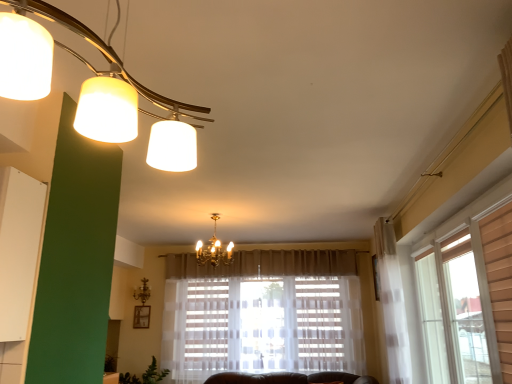
Question: Can we say white matte lampshade at upper left, positioned as the 1th lamp in top-to-bottom order, lies outside gold metallic chandelier at center, the third lamp from the top?

Choices:
 (A) yes
 (B) no

Answer: (A)

Question: From a real-world perspective, is white matte lampshade at upper left, which ranks as the third lamp in bottom-to-top order, physically below gold metallic chandelier at center, the 1th lamp when ordered from back to front?

Choices:
 (A) no
 (B) yes

Answer: (A)

Question: Does white matte lampshade at upper left, which is the 1th lamp in front-to-back order, have a larger size compared to gold metallic chandelier at center, which is counted as the 3th lamp, starting from the right?

Choices:
 (A) no
 (B) yes

Answer: (B)

Question: Would you say white matte lampshade at upper left, positioned as the 1th lamp in top-to-bottom order, contains gold metallic chandelier at center, arranged as the first lamp when viewed from the left?

Choices:
 (A) no
 (B) yes

Answer: (A)

Question: Can you confirm if white matte lampshade at upper left, the third lamp positioned from the back, is thinner than gold metallic chandelier at center, arranged as the first lamp when viewed from the left?

Choices:
 (A) no
 (B) yes

Answer: (A)

Question: From a real-world perspective, does white matte lampshade at upper left, placed as the third lamp when sorted from left to right, stand above gold metallic chandelier at center, which is the first lamp in bottom-to-top order?

Choices:
 (A) yes
 (B) no

Answer: (A)

Question: Is gold metallic chandelier at center, the 2th lamp positioned from the front, facing towards gold metallic chandelier at center, arranged as the first lamp when viewed from the left?

Choices:
 (A) yes
 (B) no

Answer: (B)

Question: Is the position of gold metallic chandelier at center, the 2th lamp positioned from the front, more distant than that of gold metallic chandelier at center, the third lamp from the top?

Choices:
 (A) yes
 (B) no

Answer: (B)

Question: Can you confirm if gold metallic chandelier at center, acting as the 2th lamp starting from the top, is bigger than gold metallic chandelier at center, the 1th lamp when ordered from back to front?

Choices:
 (A) no
 (B) yes

Answer: (B)

Question: From a real-world perspective, is gold metallic chandelier at center, the 2th lamp positioned from the front, below gold metallic chandelier at center, the 1th lamp when ordered from back to front?

Choices:
 (A) no
 (B) yes

Answer: (A)

Question: Would you say gold metallic chandelier at center, the second lamp when ordered from left to right, is outside gold metallic chandelier at center, arranged as the 3th lamp when viewed from the front?

Choices:
 (A) no
 (B) yes

Answer: (B)

Question: From a real-world perspective, is gold metallic chandelier at center, the second lamp when ordered from left to right, located higher than gold metallic chandelier at center, arranged as the first lamp when viewed from the left?

Choices:
 (A) yes
 (B) no

Answer: (A)

Question: Is white matte lampshade at upper left, which is the 1th lamp in front-to-back order, to the right of gold metallic chandelier at center, the second lamp when ordered from left to right, from the viewer's perspective?

Choices:
 (A) no
 (B) yes

Answer: (B)